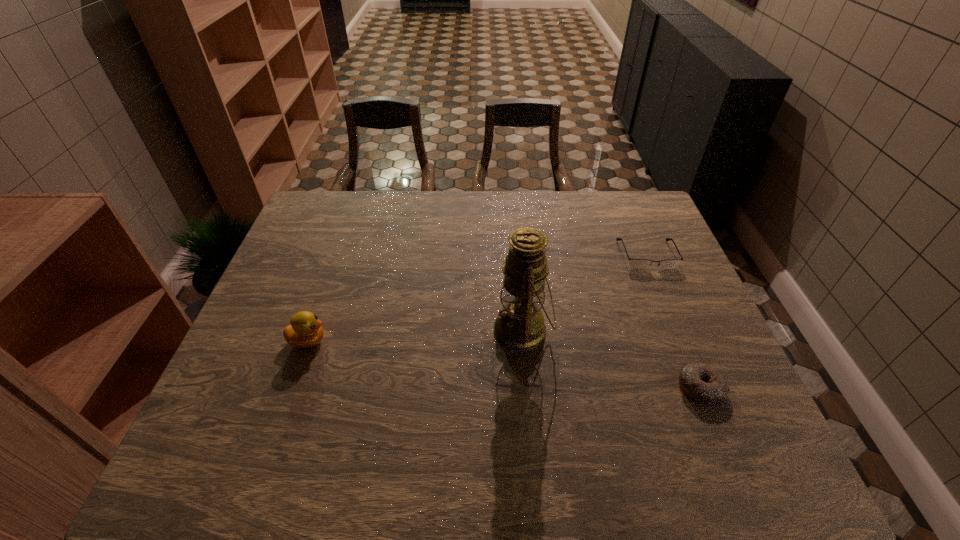
Image resolution: width=960 pixels, height=540 pixels. Identify the location of the tallest object. (520, 326).

This screenshot has width=960, height=540. In order to click on oil lamp in this screenshot , I will do `click(520, 326)`.

At what (x,y) coordinates should I click in order to perform the action: click on the third shortest object. Please return your answer as a coordinate pair (x, y). This screenshot has height=540, width=960. Looking at the image, I should click on (305, 331).

This screenshot has height=540, width=960. I want to click on the leftmost object, so click(x=305, y=331).

Locate an element on the screen. This screenshot has width=960, height=540. doughnut is located at coordinates (703, 383).

Find the location of a particular element. This screenshot has height=540, width=960. spectacles is located at coordinates (633, 263).

In order to click on vacant space located 0.050m on the right of the oil lamp in this screenshot , I will do `click(571, 330)`.

You are a GUI agent. You are given a task and a screenshot of the screen. Output one action in this format:
    pyautogui.click(x=<x>, y=<y>)
    Task: Click on the vacant space located on the face of the leftmost object
    The height and width of the screenshot is (540, 960).
    Given the screenshot: What is the action you would take?
    pyautogui.click(x=375, y=341)

Locate an element on the screen. Image resolution: width=960 pixels, height=540 pixels. free region located on the front of the nearest object is located at coordinates (734, 471).

Locate an element on the screen. blank area located on the front-facing side of the spectacles is located at coordinates (665, 298).